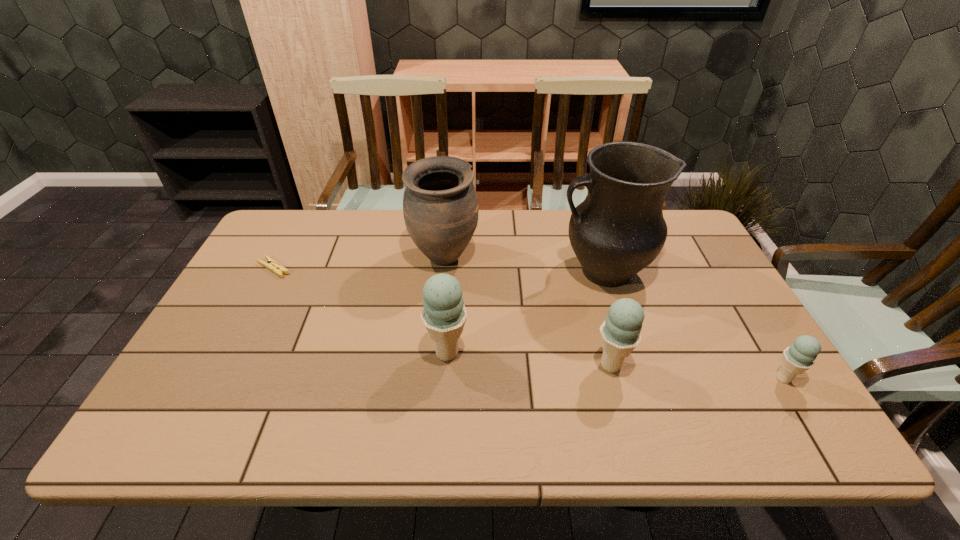
Find the location of a particular element. The width and height of the screenshot is (960, 540). the leftmost ice cream is located at coordinates (444, 314).

Locate an element on the screen. the third shortest object is located at coordinates (620, 333).

You are a GUI agent. You are given a task and a screenshot of the screen. Output one action in this format:
    pyautogui.click(x=<x>, y=<y>)
    Task: Click on the second tallest ice cream
    The image size is (960, 540).
    Given the screenshot: What is the action you would take?
    pyautogui.click(x=620, y=333)

Locate an element on the screen. the rightmost object is located at coordinates (799, 357).

Identify the location of the rightmost ice cream. The width and height of the screenshot is (960, 540). (799, 357).

This screenshot has height=540, width=960. What are the coordinates of `the tallest object` in the screenshot? It's located at (618, 230).

Where is `urn`? The height and width of the screenshot is (540, 960). urn is located at coordinates (440, 206).

What are the coordinates of `the shortest object` in the screenshot? It's located at [272, 265].

Locate an element on the screen. clothespin is located at coordinates (272, 265).

Find the location of `blank area located 0.130m on the right of the leftmost ice cream`. blank area located 0.130m on the right of the leftmost ice cream is located at coordinates point(522,353).